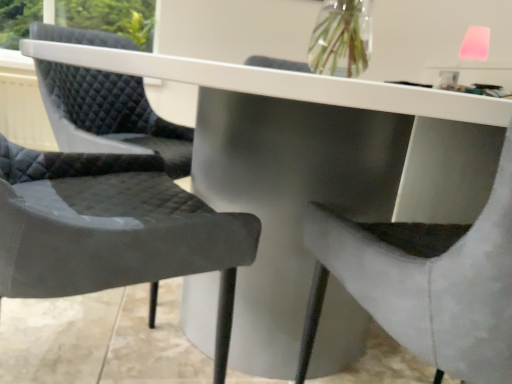
Question: Is matte black chair at center, arranged as the 1th chair when viewed from the left, bigger than suede-like gray chair at center, the 2th chair when ordered from left to right?

Choices:
 (A) no
 (B) yes

Answer: (A)

Question: Does matte black chair at center, acting as the second chair starting from the right, have a lesser width compared to suede-like gray chair at center, the 2th chair when ordered from left to right?

Choices:
 (A) no
 (B) yes

Answer: (B)

Question: Does matte black chair at center, acting as the second chair starting from the right, have a smaller size compared to suede-like gray chair at center, arranged as the first chair when viewed from the right?

Choices:
 (A) no
 (B) yes

Answer: (B)

Question: Is matte black chair at center, acting as the second chair starting from the right, closer to camera compared to suede-like gray chair at center, arranged as the first chair when viewed from the right?

Choices:
 (A) no
 (B) yes

Answer: (A)

Question: Does matte black chair at center, acting as the second chair starting from the right, lie behind suede-like gray chair at center, the 2th chair when ordered from left to right?

Choices:
 (A) no
 (B) yes

Answer: (B)

Question: Is matte black chair at center, arranged as the 1th chair when viewed from the left, surrounding suede-like gray chair at center, the 2th chair when ordered from left to right?

Choices:
 (A) yes
 (B) no

Answer: (B)

Question: From a real-world perspective, is suede-like gray chair at center, arranged as the first chair when viewed from the right, on matte black chair at center, acting as the second chair starting from the right?

Choices:
 (A) yes
 (B) no

Answer: (B)

Question: Is suede-like gray chair at center, arranged as the first chair when viewed from the right, placed right next to matte black chair at center, acting as the second chair starting from the right?

Choices:
 (A) no
 (B) yes

Answer: (A)

Question: Is suede-like gray chair at center, the 2th chair when ordered from left to right, shorter than matte black chair at center, acting as the second chair starting from the right?

Choices:
 (A) yes
 (B) no

Answer: (A)

Question: Does suede-like gray chair at center, the 2th chair when ordered from left to right, have a lesser width compared to matte black chair at center, acting as the second chair starting from the right?

Choices:
 (A) yes
 (B) no

Answer: (B)

Question: From a real-world perspective, is suede-like gray chair at center, the 2th chair when ordered from left to right, beneath matte black chair at center, arranged as the 1th chair when viewed from the left?

Choices:
 (A) no
 (B) yes

Answer: (B)

Question: Does suede-like gray chair at center, arranged as the first chair when viewed from the right, have a smaller size compared to matte black chair at center, acting as the second chair starting from the right?

Choices:
 (A) yes
 (B) no

Answer: (B)

Question: From a real-world perspective, is suede-like gray chair at center, arranged as the first chair when viewed from the right, positioned above or below matte black chair at center, arranged as the 1th chair when viewed from the left?

Choices:
 (A) below
 (B) above

Answer: (A)